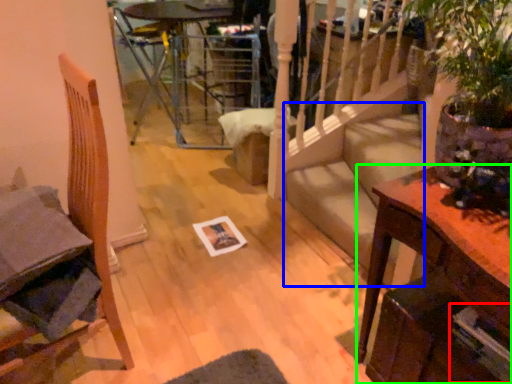
Question: Which is nearer to the magazine (highlighted by a red box)? stairwell (highlighted by a blue box) or table (highlighted by a green box).

Choices:
 (A) stairwell
 (B) table

Answer: (B)